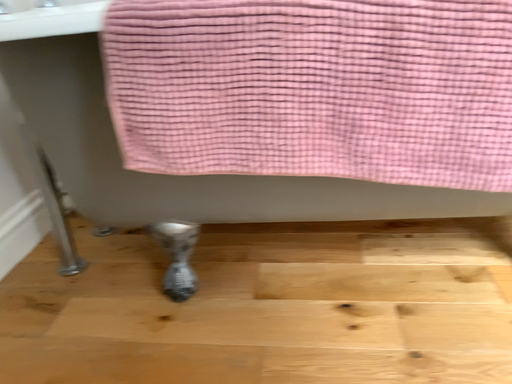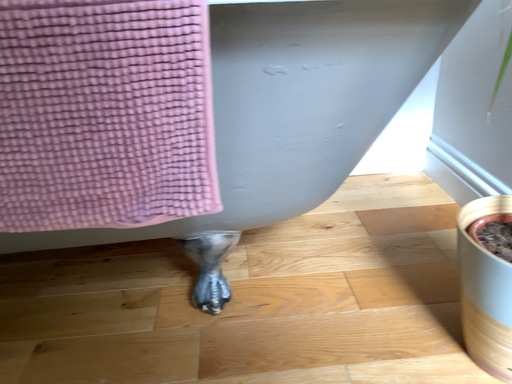
Question: Which way did the camera rotate in the video?

Choices:
 (A) rotated right
 (B) rotated left

Answer: (A)